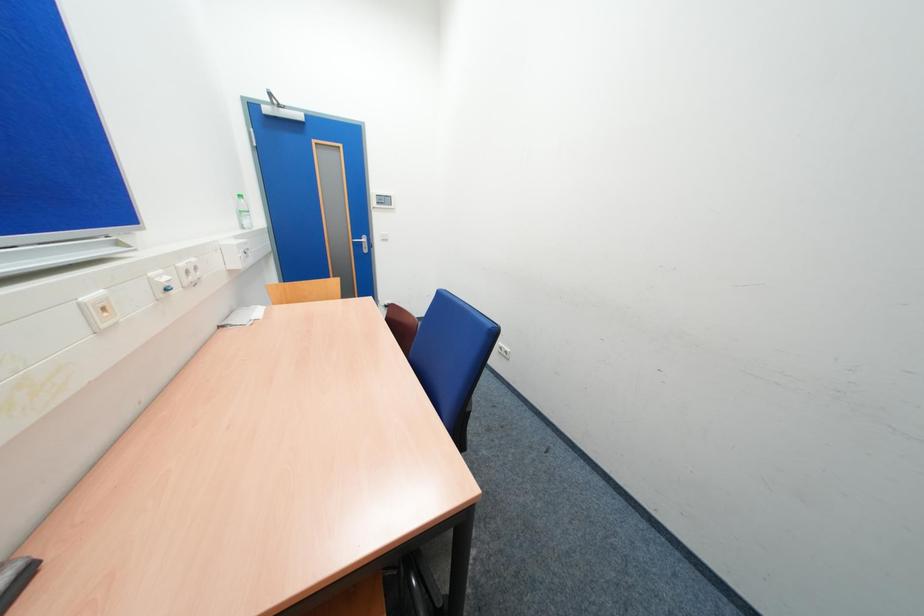
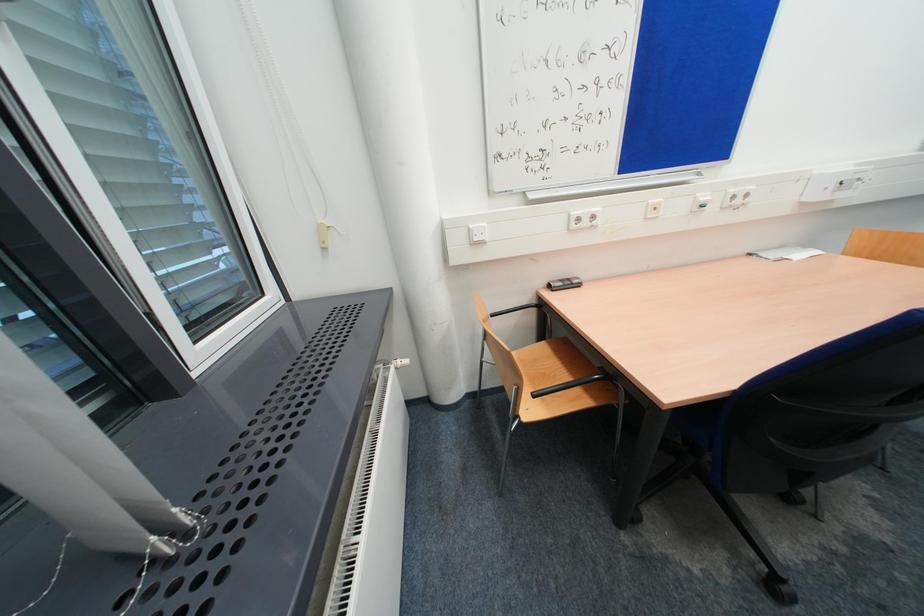
How did the camera likely rotate?

The camera rotated toward left-down.